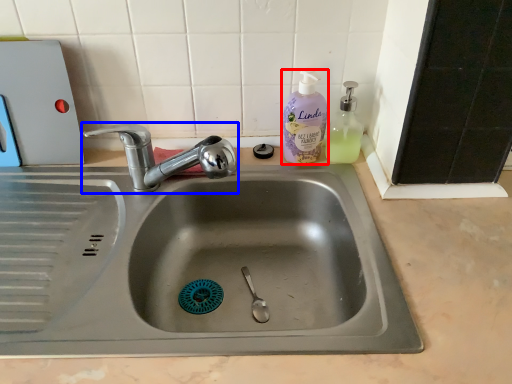
Question: Which of the following is the closest to the observer, cleaning product (highlighted by a red box) or tap (highlighted by a blue box)?

Choices:
 (A) cleaning product
 (B) tap

Answer: (B)